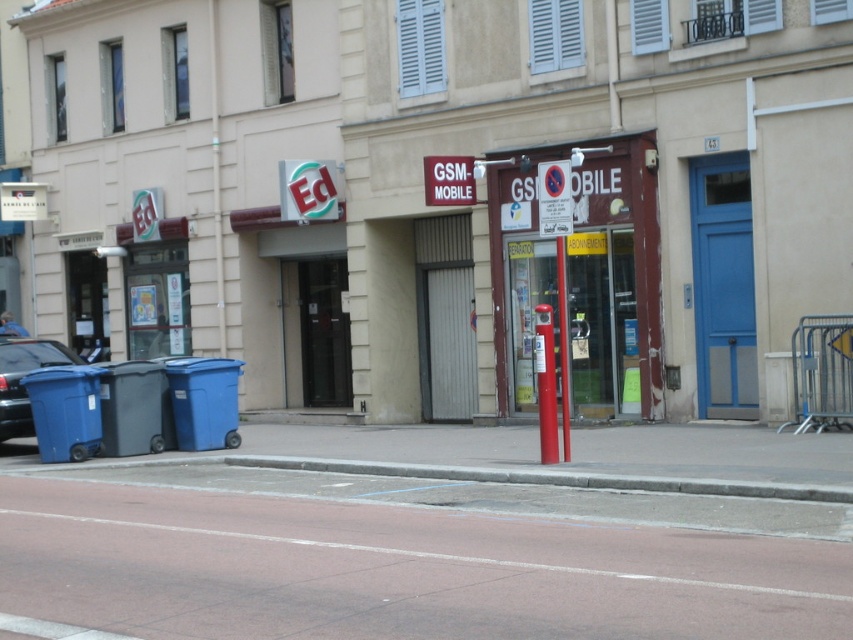
Consider the image. Between concrete at lower center and red plastic pole at center, which one is positioned higher?

red plastic pole at center

Which is more to the left, concrete at lower center or red plastic pole at center?

Positioned to the left is concrete at lower center.

Image resolution: width=853 pixels, height=640 pixels. Find the location of `concrete at lower center`. concrete at lower center is located at coordinates click(x=552, y=477).

Between concrete at lower center and metallic blue car at left, which one has more height?

With more height is metallic blue car at left.

Does concrete at lower center appear on the right side of metallic blue car at left?

Yes, concrete at lower center is to the right of metallic blue car at left.

Image resolution: width=853 pixels, height=640 pixels. Describe the element at coordinates (552, 477) in the screenshot. I see `concrete at lower center` at that location.

The width and height of the screenshot is (853, 640). I want to click on concrete at lower center, so click(x=552, y=477).

Is point (20, 387) behind point (556, 250)?

Yes, point (20, 387) is behind point (556, 250).

Who is positioned more to the right, metallic blue car at left or red plastic pole at center?

red plastic pole at center

Who is more distant from viewer, (x=47, y=346) or (x=556, y=273)?

Point (x=47, y=346)

I want to click on metallic blue car at left, so click(x=22, y=376).